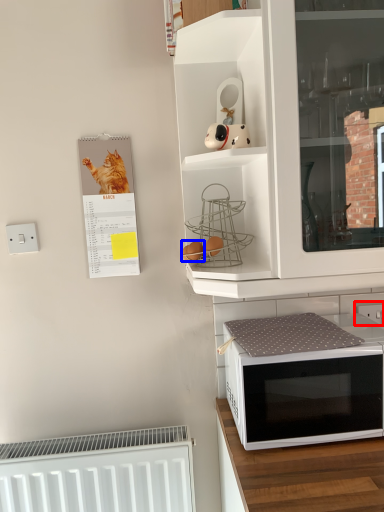
Question: Which object appears closest to the camera in this image, electric outlet (highlighted by a red box) or food (highlighted by a blue box)?

Choices:
 (A) electric outlet
 (B) food

Answer: (B)